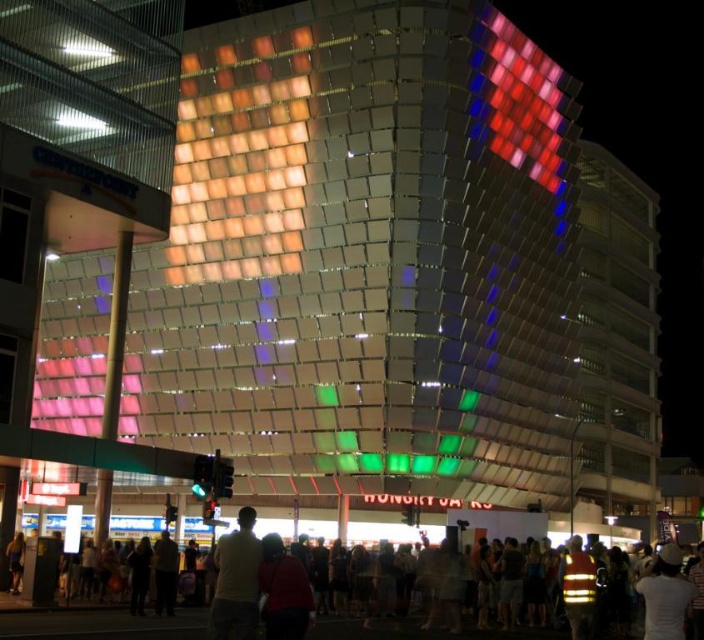
You are a fashion designer observing the vibrant urban scene at night. You notice a person wearing a white matte shirt at center and dark blue jeans at lower left. Which clothing item appears taller in the image?

The white matte shirt at center has a greater height compared to the dark blue jeans at lower left, so the white matte shirt at center appears taller in the image.